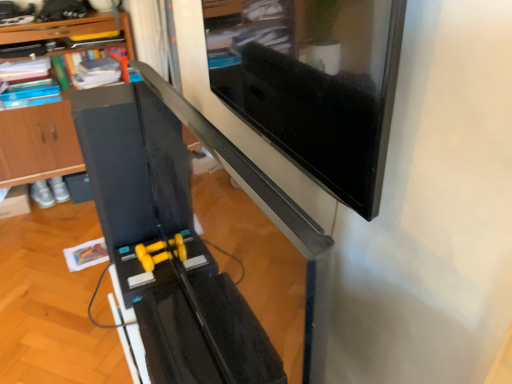
Question: Would you say black glossy computer desk at center is to the left or to the right of matte black monitor at upper right in the picture?

Choices:
 (A) right
 (B) left

Answer: (B)

Question: Considering the positions of black glossy computer desk at center and matte black monitor at upper right in the image, is black glossy computer desk at center wider or thinner than matte black monitor at upper right?

Choices:
 (A) wide
 (B) thin

Answer: (A)

Question: Based on their relative distances, which object is farther from the wooden at left?

Choices:
 (A) matte black monitor at upper right
 (B) black glossy computer desk at center

Answer: (A)

Question: Which of these objects is positioned farthest from the matte black monitor at upper right?

Choices:
 (A) wooden at left
 (B) black glossy computer desk at center

Answer: (A)